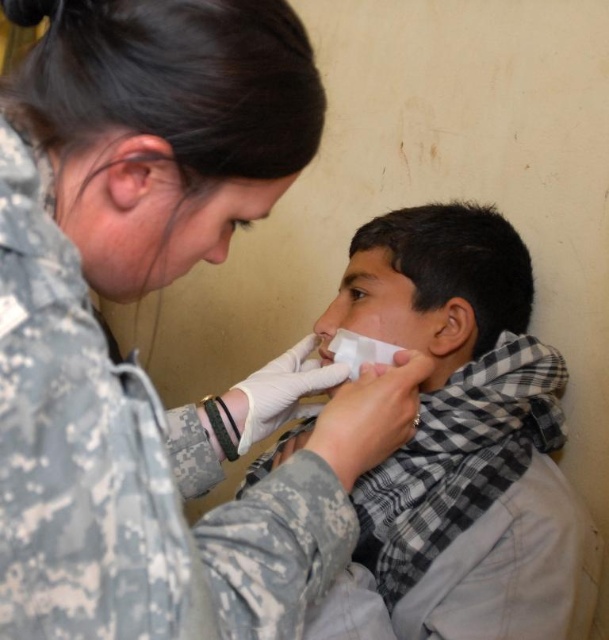
You are a photographer taking a photo of the scene. You want to focus on the camouflage uniform at center and the white checkered scarf at center. Which object should you adjust your camera focus on first if you want to ensure both are in focus?

The camouflage uniform at center is closer to the viewer than the white checkered scarf at center, so you should focus on the camouflage uniform at center first to ensure both are in focus.

You are a nurse in a field hospital. You need to place a medical kit between the point at point (333, 476) and another point 19.19 inches away. Where should you place the medical kit?

The medical kit should be placed 19.19 inches away from the point at point (333, 476).